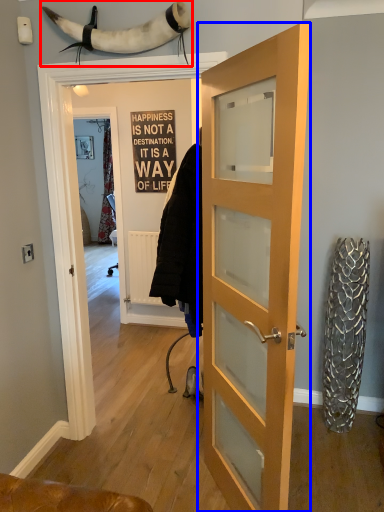
Question: Which object is further to the camera taking this photo, animal (highlighted by a red box) or door (highlighted by a blue box)?

Choices:
 (A) animal
 (B) door

Answer: (A)